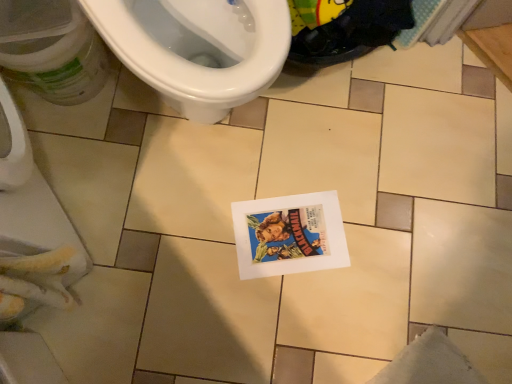
Image resolution: width=512 pixels, height=384 pixels. I want to click on free region on the left part of white paper comic book at center, so click(x=205, y=219).